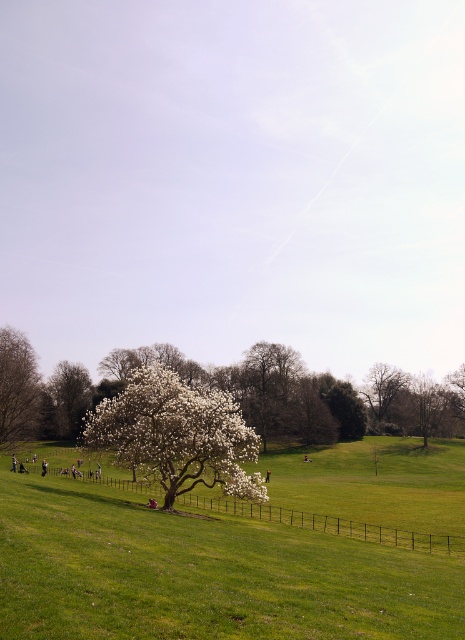
Looking at this image, you are planning to place a picnic blanket in the park. You want to choose a spot where the white fluffy tree at center and the white textured tree at left are both visible. Which tree should you position yourself closer to in order to ensure both are in your view?

To ensure both the white fluffy tree at center and the white textured tree at left are visible, you should position yourself closer to the white textured tree at left since it is narrower in width compared to the white fluffy tree at center. This allows for a wider field of view to include both trees.

You are planning to plant a new tree in your backyard and want to know which tree from the image would cast a larger shadow. Based on the scene, which tree between the white fluffy tree at lower left and the smooth bark tree at center should you choose?

The white fluffy tree at lower left is bigger than the smooth bark tree at center, so it would cast a larger shadow.